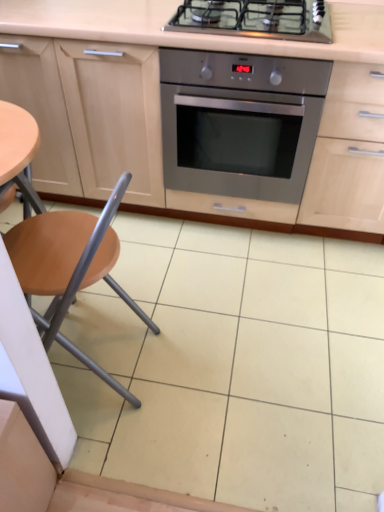
This screenshot has height=512, width=384. I want to click on stainless steel oven at center, so click(240, 123).

Locate an element on the screen. This screenshot has width=384, height=512. matte wood cabinetry at center is located at coordinates (262, 54).

The image size is (384, 512). What do you see at coordinates (256, 18) in the screenshot?
I see `stainless steel gas stove at upper center` at bounding box center [256, 18].

This screenshot has width=384, height=512. I want to click on wooden seat at left, so click(70, 268).

Looking at this image, considering the sizes of objects stainless steel oven at center and matte wood cabinetry at center in the image provided, who is shorter, stainless steel oven at center or matte wood cabinetry at center?

stainless steel oven at center is shorter.

Can you tell me how much stainless steel oven at center and matte wood cabinetry at center differ in facing direction?

There is a 0.542-degree angle between the facing directions of stainless steel oven at center and matte wood cabinetry at center.

Is matte wood cabinetry at center surrounded by stainless steel oven at center?

No, matte wood cabinetry at center is not a part of stainless steel oven at center.

Is stainless steel oven at center turned away from matte wood cabinetry at center?

Yes, stainless steel oven at center's orientation is away from matte wood cabinetry at center.

Which is more to the left, matte wood cabinetry at center or stainless steel oven at center?

matte wood cabinetry at center is more to the left.

Is matte wood cabinetry at center facing towards stainless steel oven at center?

Yes.

In the scene shown: From the image's perspective, is matte wood cabinetry at center beneath stainless steel oven at center?

Incorrect, from the image's perspective, matte wood cabinetry at center is higher than stainless steel oven at center.

From a real-world perspective, which is physically below, matte wood cabinetry at center or stainless steel oven at center?

From a 3D spatial view, stainless steel oven at center is below.

Can you confirm if matte wood cabinetry at center is wider than wooden seat at left?

Yes, matte wood cabinetry at center is wider than wooden seat at left.

From the image's perspective, between matte wood cabinetry at center and wooden seat at left, who is located below?

wooden seat at left, from the image's perspective.

Is matte wood cabinetry at center oriented towards wooden seat at left?

Yes, matte wood cabinetry at center is turned towards wooden seat at left.

Can you confirm if matte wood cabinetry at center is positioned to the right of wooden seat at left?

Correct, you'll find matte wood cabinetry at center to the right of wooden seat at left.

Is point (248, 22) closer or farther from the camera than point (200, 130)?

Point (248, 22) is positioned closer to the camera compared to point (200, 130).

Is stainless steel gas stove at upper center beside stainless steel oven at center?

No, stainless steel gas stove at upper center is not beside stainless steel oven at center.

Does stainless steel gas stove at upper center have a greater height compared to stainless steel oven at center?

Incorrect, the height of stainless steel gas stove at upper center is not larger of that of stainless steel oven at center.

Which object is positioned more to the left, stainless steel gas stove at upper center or stainless steel oven at center?

Positioned to the left is stainless steel gas stove at upper center.

Is stainless steel gas stove at upper center looking in the opposite direction of wooden seat at left?

stainless steel gas stove at upper center does not have its back to wooden seat at left.

Considering the relative sizes of stainless steel gas stove at upper center and wooden seat at left in the image provided, is stainless steel gas stove at upper center wider than wooden seat at left?

Indeed, stainless steel gas stove at upper center has a greater width compared to wooden seat at left.

Which is less distant, (304, 11) or (73, 238)?

Point (304, 11) appears to be farther away from the viewer than point (73, 238).

Is stainless steel gas stove at upper center shorter than wooden seat at left?

Indeed, stainless steel gas stove at upper center has a lesser height compared to wooden seat at left.

Considering the sizes of wooden seat at left and matte wood cabinetry at center in the image, is wooden seat at left taller or shorter than matte wood cabinetry at center?

In the image, wooden seat at left appears to be shorter than matte wood cabinetry at center.

Is wooden seat at left located outside matte wood cabinetry at center?

Yes, wooden seat at left is outside of matte wood cabinetry at center.

Could you tell me if wooden seat at left is turned towards matte wood cabinetry at center?

No, wooden seat at left does not turn towards matte wood cabinetry at center.

Which object is wider, stainless steel oven at center or wooden seat at left?

stainless steel oven at center.

Considering the relative sizes of stainless steel oven at center and wooden seat at left in the image provided, is stainless steel oven at center smaller than wooden seat at left?

No, stainless steel oven at center is not smaller than wooden seat at left.

Is stainless steel oven at center further to the viewer compared to wooden seat at left?

That is True.

Considering the sizes of objects stainless steel oven at center and wooden seat at left in the image provided, who is taller, stainless steel oven at center or wooden seat at left?

wooden seat at left.

This screenshot has width=384, height=512. I want to click on kitchen appliance behind the matte wood cabinetry at center, so click(x=240, y=123).

The image size is (384, 512). Identify the location of cabinetry above the stainless steel oven at center (from the image's perspective). (262, 54).

Looking at the image, which one is located closer to matte wood cabinetry at center, wooden seat at left or stainless steel oven at center?

stainless steel oven at center is closer to matte wood cabinetry at center.

Based on their spatial positions, is stainless steel gas stove at upper center or wooden seat at left closer to matte wood cabinetry at center?

The object closer to matte wood cabinetry at center is stainless steel gas stove at upper center.

Estimate the real-world distances between objects in this image. Which object is closer to matte wood cabinetry at center, stainless steel oven at center or stainless steel gas stove at upper center?

stainless steel oven at center is positioned closer to the anchor matte wood cabinetry at center.

Estimate the real-world distances between objects in this image. Which object is closer to wooden seat at left, stainless steel oven at center or matte wood cabinetry at center?

The object closer to wooden seat at left is stainless steel oven at center.

Estimate the real-world distances between objects in this image. Which object is closer to wooden seat at left, stainless steel gas stove at upper center or stainless steel oven at center?

stainless steel oven at center is positioned closer to the anchor wooden seat at left.

Considering their positions, is wooden seat at left positioned closer to stainless steel gas stove at upper center than matte wood cabinetry at center?

matte wood cabinetry at center is closer to stainless steel gas stove at upper center.

Estimate the real-world distances between objects in this image. Which object is closer to stainless steel oven at center, matte wood cabinetry at center or wooden seat at left?

matte wood cabinetry at center is closer to stainless steel oven at center.

Based on their spatial positions, is wooden seat at left or stainless steel oven at center further from stainless steel gas stove at upper center?

Based on the image, wooden seat at left appears to be further to stainless steel gas stove at upper center.

This screenshot has width=384, height=512. Find the location of `gas stove located between matte wood cabinetry at center and stainless steel oven at center in the left-right direction`. gas stove located between matte wood cabinetry at center and stainless steel oven at center in the left-right direction is located at coordinates (256, 18).

Image resolution: width=384 pixels, height=512 pixels. Find the location of `kitchen appliance between matte wood cabinetry at center and wooden seat at left from top to bottom`. kitchen appliance between matte wood cabinetry at center and wooden seat at left from top to bottom is located at coordinates (240, 123).

Where is `kitchen appliance between stainless steel gas stove at upper center and wooden seat at left vertically`? kitchen appliance between stainless steel gas stove at upper center and wooden seat at left vertically is located at coordinates (240, 123).

Find the location of a particular element. cabinetry between stainless steel gas stove at upper center and wooden seat at left in the up-down direction is located at coordinates (262, 54).